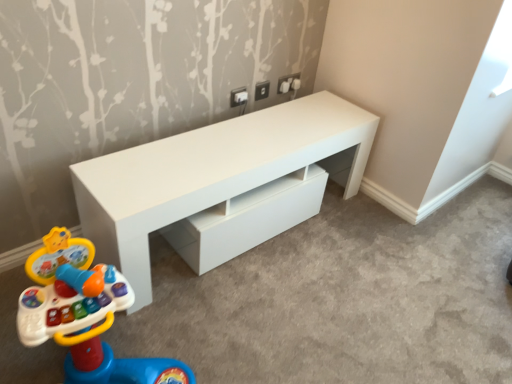
At what (x,y) coordinates should I click in order to perform the action: click on white glossy table at center. Please return your answer as a coordinate pair (x, y). Image resolution: width=512 pixels, height=384 pixels. Looking at the image, I should click on (x=212, y=173).

What do you see at coordinates (212, 173) in the screenshot? I see `white glossy table at center` at bounding box center [212, 173].

Image resolution: width=512 pixels, height=384 pixels. What do you see at coordinates (86, 318) in the screenshot?
I see `plastic multicolored xylophone at lower left` at bounding box center [86, 318].

Locate an element on the screen. This screenshot has height=384, width=512. plastic multicolored xylophone at lower left is located at coordinates (86, 318).

Locate an element on the screen. This screenshot has width=512, height=384. white glossy table at center is located at coordinates (212, 173).

Considering the positions of objects white glossy table at center and plastic multicolored xylophone at lower left in the image provided, who is more to the right, white glossy table at center or plastic multicolored xylophone at lower left?

white glossy table at center is more to the right.

Which is in front, white glossy table at center or plastic multicolored xylophone at lower left?

Positioned in front is plastic multicolored xylophone at lower left.

Considering the positions of point (295, 101) and point (154, 367), is point (295, 101) closer or farther from the camera than point (154, 367)?

Point (295, 101) is positioned farther from the camera compared to point (154, 367).

From the image's perspective, is white glossy table at center positioned above or below plastic multicolored xylophone at lower left?

white glossy table at center is situated higher than plastic multicolored xylophone at lower left in the image.

From a real-world perspective, is white glossy table at center above or below plastic multicolored xylophone at lower left?

white glossy table at center is situated lower than plastic multicolored xylophone at lower left in the real world.

Is white glossy table at center thinner than plastic multicolored xylophone at lower left?

Correct, the width of white glossy table at center is less than that of plastic multicolored xylophone at lower left.

Who is taller, white glossy table at center or plastic multicolored xylophone at lower left?

plastic multicolored xylophone at lower left is taller.

Considering the sizes of objects white glossy table at center and plastic multicolored xylophone at lower left in the image provided, who is smaller, white glossy table at center or plastic multicolored xylophone at lower left?

plastic multicolored xylophone at lower left is smaller.

Does white glossy table at center contain plastic multicolored xylophone at lower left?

That's incorrect, plastic multicolored xylophone at lower left is not inside white glossy table at center.

Is white glossy table at center not near plastic multicolored xylophone at lower left?

No, white glossy table at center is not far away from plastic multicolored xylophone at lower left.

Is white glossy table at center positioned with its back to plastic multicolored xylophone at lower left?

That's not correct — white glossy table at center is not looking away from plastic multicolored xylophone at lower left.

Identify the location of toy that appears on the left of white glossy table at center. Image resolution: width=512 pixels, height=384 pixels. (86, 318).

Can you confirm if plastic multicolored xylophone at lower left is positioned to the right of white glossy table at center?

Incorrect, plastic multicolored xylophone at lower left is not on the right side of white glossy table at center.

Is plastic multicolored xylophone at lower left in front of or behind white glossy table at center in the image?

In the image, plastic multicolored xylophone at lower left appears in front of white glossy table at center.

Is point (60, 237) behind point (339, 117)?

No.

From the image's perspective, who appears lower, plastic multicolored xylophone at lower left or white glossy table at center?

plastic multicolored xylophone at lower left, from the image's perspective.

From a real-world perspective, between plastic multicolored xylophone at lower left and white glossy table at center, who is vertically lower?

From a 3D spatial view, white glossy table at center is below.

Based on the photo, is plastic multicolored xylophone at lower left thinner than white glossy table at center?

No.

Which of these two, plastic multicolored xylophone at lower left or white glossy table at center, stands taller?

With more height is plastic multicolored xylophone at lower left.

Based on the photo, does plastic multicolored xylophone at lower left have a smaller size compared to white glossy table at center?

Yes, plastic multicolored xylophone at lower left is smaller than white glossy table at center.

Looking at this image, is white glossy table at center surrounded by plastic multicolored xylophone at lower left?

No, white glossy table at center is not a part of plastic multicolored xylophone at lower left.

Is plastic multicolored xylophone at lower left far away from white glossy table at center?

No, there isn't a large distance between plastic multicolored xylophone at lower left and white glossy table at center.

Is plastic multicolored xylophone at lower left turned away from white glossy table at center?

No, plastic multicolored xylophone at lower left's orientation is not away from white glossy table at center.

What's the angular difference between plastic multicolored xylophone at lower left and white glossy table at center's facing directions?

plastic multicolored xylophone at lower left and white glossy table at center are facing 9.49 degrees away from each other.

Looking at this image, measure the distance from plastic multicolored xylophone at lower left to white glossy table at center.

plastic multicolored xylophone at lower left and white glossy table at center are 19.11 inches apart.

This screenshot has width=512, height=384. I want to click on table located above the plastic multicolored xylophone at lower left (from the image's perspective), so click(x=212, y=173).

Identify the location of table above the plastic multicolored xylophone at lower left (from the image's perspective). The height and width of the screenshot is (384, 512). (212, 173).

This screenshot has height=384, width=512. What are the coordinates of `toy located in front of the white glossy table at center` in the screenshot? It's located at (86, 318).